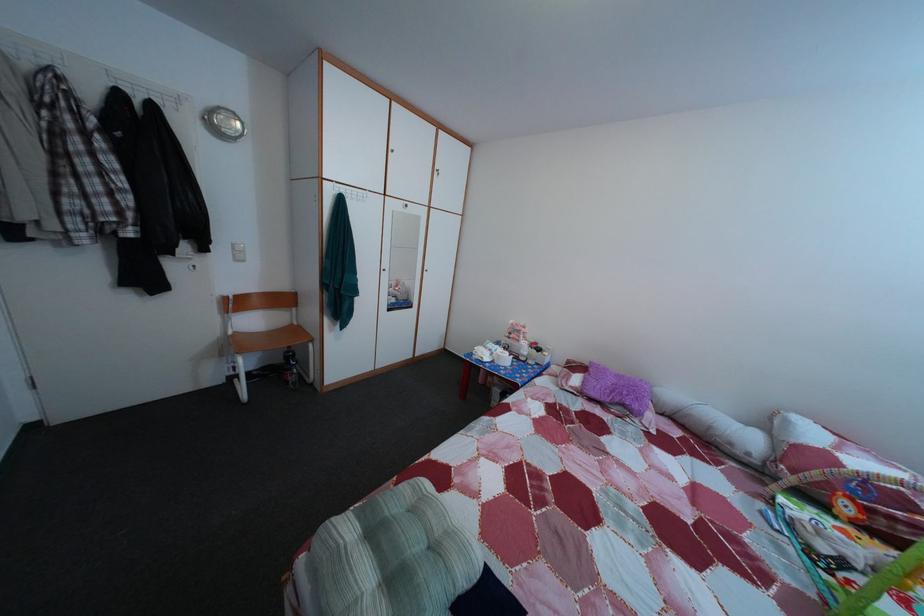
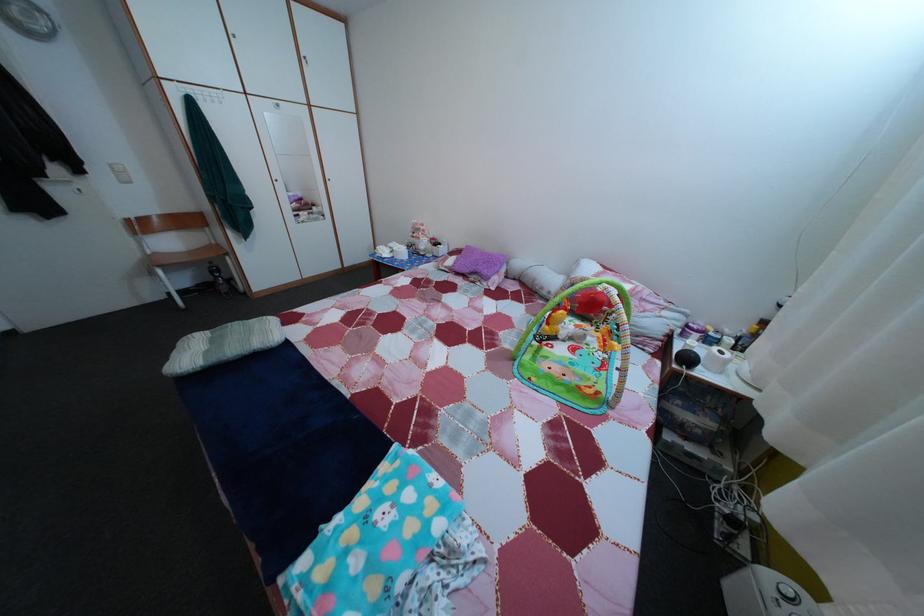
Question: I am providing you with two images of the same scene from different viewpoints. Which of the following objects are not visible in image2?

Choices:
 (A) bottle pump top
 (B) cabinet door handle
 (C) grey roll pillow
 (D) none of these

Answer: (D)